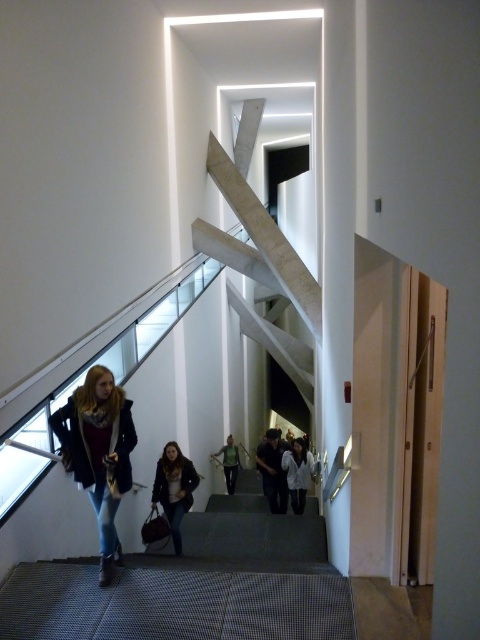
Is dark gray fabric jacket at center below green fabric shirt at center?

No, dark gray fabric jacket at center is not below green fabric shirt at center.

This screenshot has width=480, height=640. What do you see at coordinates (273, 472) in the screenshot?
I see `dark gray fabric jacket at center` at bounding box center [273, 472].

Locate an element on the screen. The width and height of the screenshot is (480, 640). dark gray fabric jacket at center is located at coordinates (273, 472).

Locate an element on the screen. dark gray fabric jacket at center is located at coordinates (273, 472).

Which is behind, point (180, 480) or point (230, 445)?

The point (230, 445) is more distant.

Is point (170, 442) behind point (237, 470)?

No.

Between point (159, 474) and point (227, 481), which one is positioned in front?

Point (159, 474) is in front.

The width and height of the screenshot is (480, 640). I want to click on denim jacket at center, so click(x=173, y=488).

Based on the photo, which of these two, matte black coat at lower left or white cotton hoodie at center, stands taller?

With more height is matte black coat at lower left.

Which is more to the right, matte black coat at lower left or white cotton hoodie at center?

From the viewer's perspective, white cotton hoodie at center appears more on the right side.

Which is behind, point (68, 410) or point (292, 493)?

Positioned behind is point (292, 493).

Where is `matte black coat at lower left`? Image resolution: width=480 pixels, height=640 pixels. matte black coat at lower left is located at coordinates (98, 452).